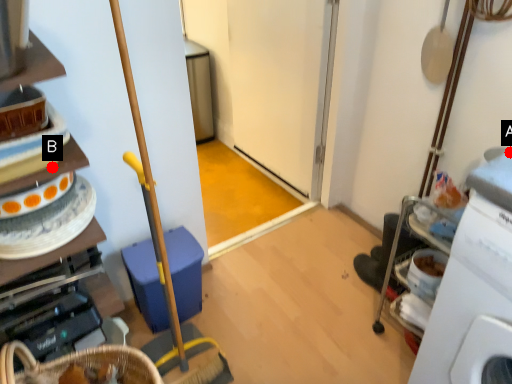
Question: Two points are circled on the image, labeled by A and B beside each circle. Which point is closer to the camera?

Choices:
 (A) A is closer
 (B) B is closer

Answer: (B)